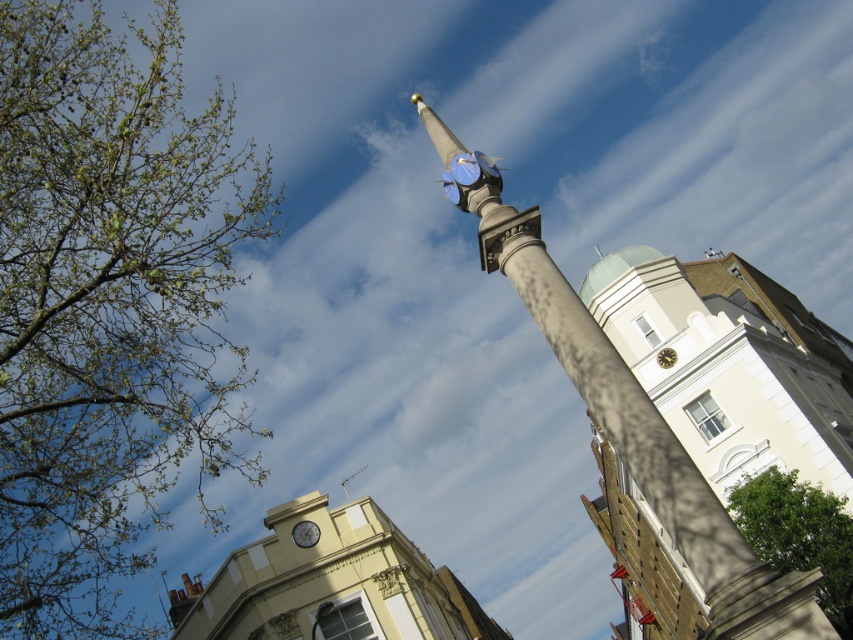
Between light beige stone clock tower at upper center and smooth stone pole at center, which one has more height?

With more height is light beige stone clock tower at upper center.

Is light beige stone clock tower at upper center wider than smooth stone pole at center?

Yes.

Is point (642, 554) less distant than point (517, 221)?

That is False.

Where is `light beige stone clock tower at upper center`? The width and height of the screenshot is (853, 640). light beige stone clock tower at upper center is located at coordinates (729, 364).

Does point (634, 612) come closer to viewer compared to point (822, 529)?

No, (634, 612) is behind (822, 529).

Which of these two, light beige stone clock tower at upper center or green leafy tree at lower right, stands taller?

Standing taller between the two is light beige stone clock tower at upper center.

The height and width of the screenshot is (640, 853). Describe the element at coordinates (729, 364) in the screenshot. I see `light beige stone clock tower at upper center` at that location.

Locate an element on the screen. The height and width of the screenshot is (640, 853). light beige stone clock tower at upper center is located at coordinates (729, 364).

Does point (743, 390) come closer to viewer compared to point (294, 532)?

No, (743, 390) is further to viewer.

Can you confirm if light beige stone clock tower at upper center is taller than matte silver clock at center?

Indeed, light beige stone clock tower at upper center has a greater height compared to matte silver clock at center.

Is point (599, 289) closer to camera compared to point (303, 532)?

That is False.

Locate an element on the screen. light beige stone clock tower at upper center is located at coordinates point(729,364).